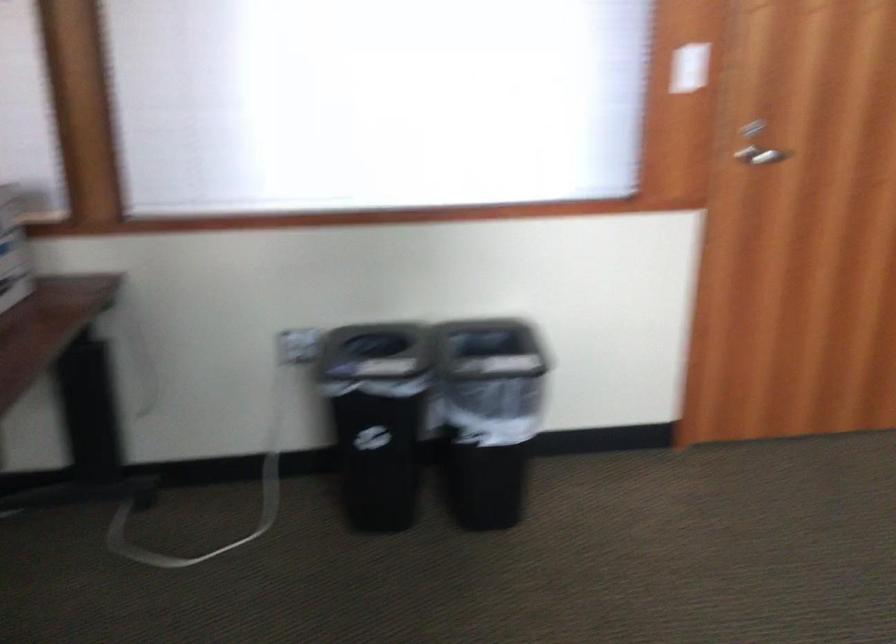
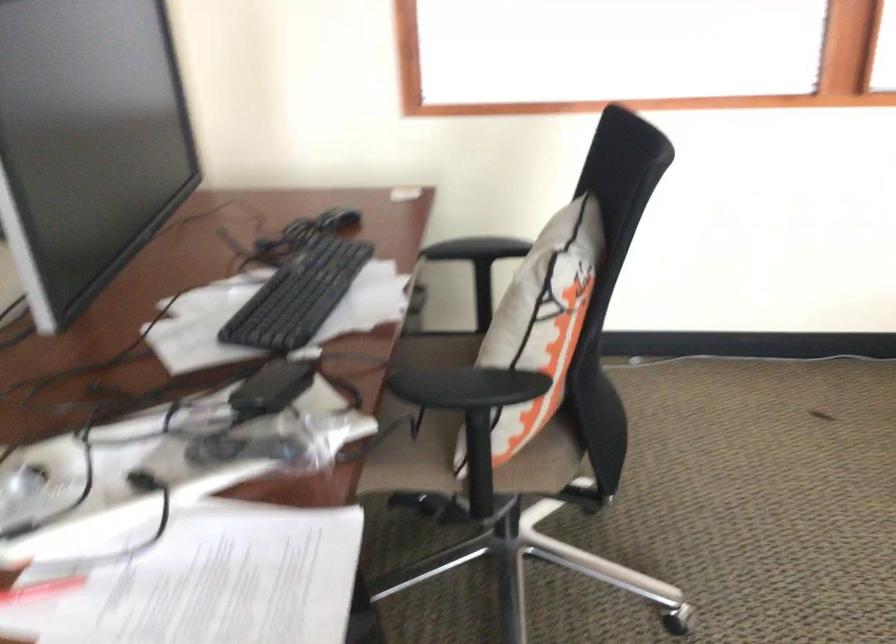
Question: What movement of the cameraman would produce the second image?

Choices:
 (A) Left
 (B) Right
 (C) Forward
 (D) Backward

Answer: (A)